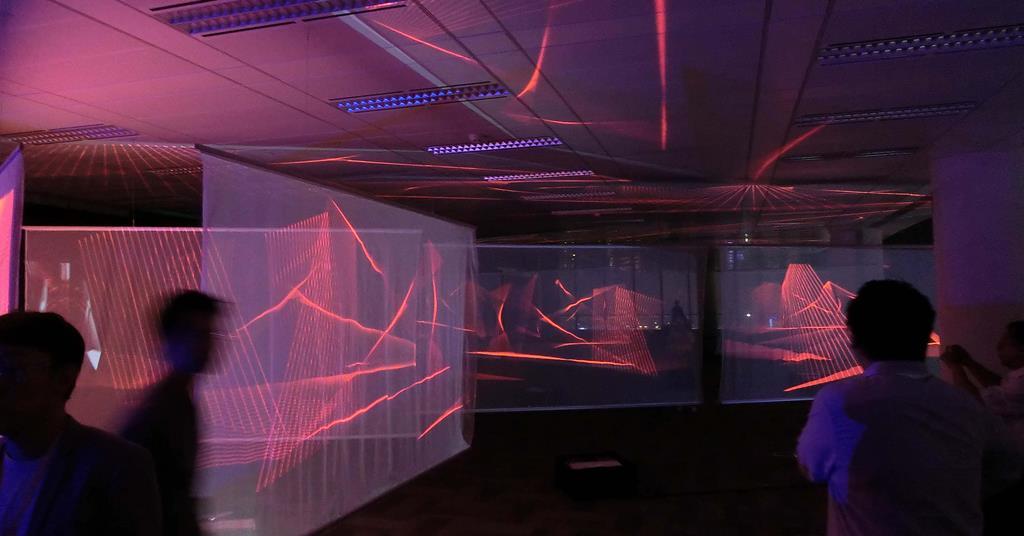
You are a GUI agent. You are given a task and a screenshot of the screen. Output one action in this format:
    pyautogui.click(x=<x>, y=<y>)
    Task: Click on the purple light
    The width and height of the screenshot is (1024, 536).
    Given the screenshot: What is the action you would take?
    pyautogui.click(x=478, y=147)